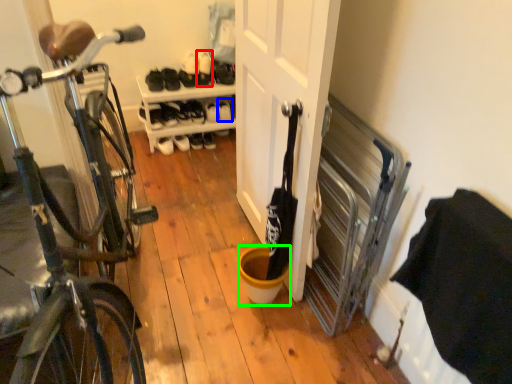
Question: Based on their relative distances, which object is farther from shoe (highlighted by a red box)? Choose from shoe (highlighted by a blue box) and bucket (highlighted by a green box).

Choices:
 (A) shoe
 (B) bucket

Answer: (B)